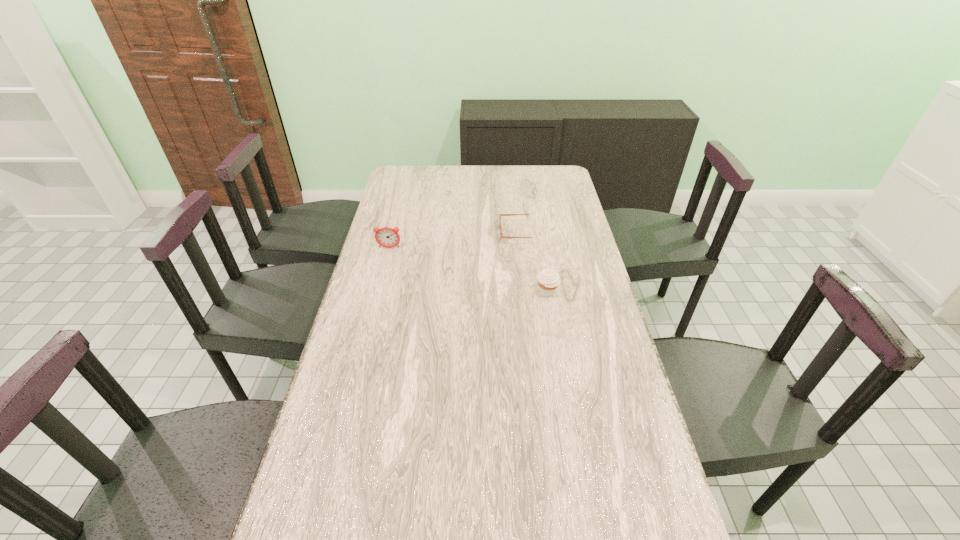
In order to click on free spot that satisfies the following two spatial constraints: 1. on the front-facing side of the nearest object; 2. on the left side of the shortest object in this screenshot , I will do `click(527, 292)`.

In order to click on vacant space that satisfies the following two spatial constraints: 1. on the front-facing side of the sunglasses; 2. on the front-facing side of the second nearest object in this screenshot , I will do `click(522, 248)`.

Where is `vacant region that satisfies the following two spatial constraints: 1. on the front-facing side of the sunglasses; 2. on the right side of the nearest object`? This screenshot has height=540, width=960. vacant region that satisfies the following two spatial constraints: 1. on the front-facing side of the sunglasses; 2. on the right side of the nearest object is located at coordinates 527,292.

The image size is (960, 540). In order to click on vacant space that satisfies the following two spatial constraints: 1. on the front-facing side of the sunglasses; 2. on the front-facing side of the alarm clock in this screenshot , I will do `click(522, 248)`.